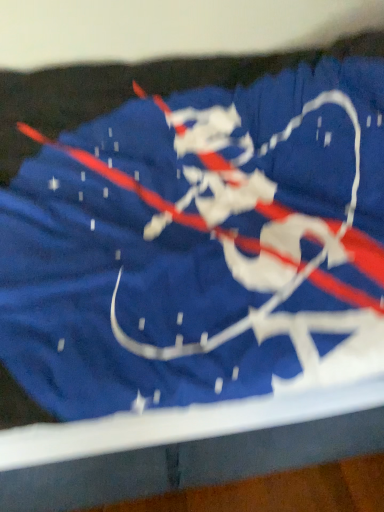
Find the location of a particular element. The height and width of the screenshot is (512, 384). blue fabric flag at center is located at coordinates (178, 236).

What do you see at coordinates (178, 236) in the screenshot? The image size is (384, 512). I see `blue fabric flag at center` at bounding box center [178, 236].

Identify the location of blue fabric flag at center. (178, 236).